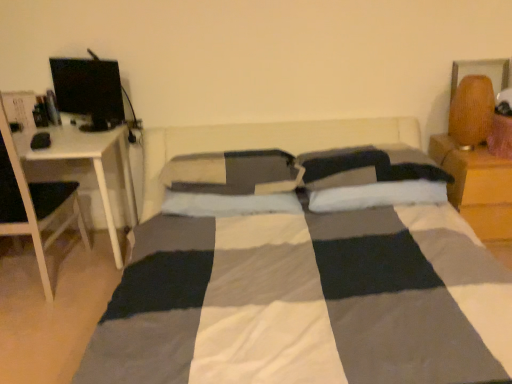
Question: Is matte black monitor at upper left inside or outside of white soft pillow at center, the second pillow in the right-to-left sequence?

Choices:
 (A) outside
 (B) inside

Answer: (A)

Question: In terms of height, does matte black monitor at upper left look taller or shorter compared to white soft pillow at center, which is counted as the 2th pillow, starting from the left?

Choices:
 (A) tall
 (B) short

Answer: (A)

Question: Estimate the real-world distances between objects in this image. Which object is closer to the matte black monitor at upper left?

Choices:
 (A) white soft pillow at center, the second pillow in the right-to-left sequence
 (B) braided wood table lamp at upper right
 (C) white plastic computer desk at left
 (D) wooden nightstand at right
 (E) soft gray pillow at center, which ranks as the first pillow in left-to-right order

Answer: (C)

Question: Which object is the farthest from the soft gray pillow at center, the third pillow positioned from the right?

Choices:
 (A) wooden nightstand at right
 (B) white plastic computer desk at left
 (C) matte black monitor at upper left
 (D) braided wood table lamp at upper right
 (E) white soft pillow at center, which is the 1th pillow from right to left

Answer: (D)